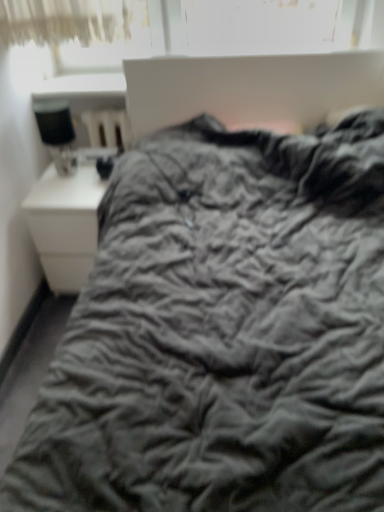
The image size is (384, 512). I want to click on unoccupied area in front of matte black lamp at left, so click(63, 190).